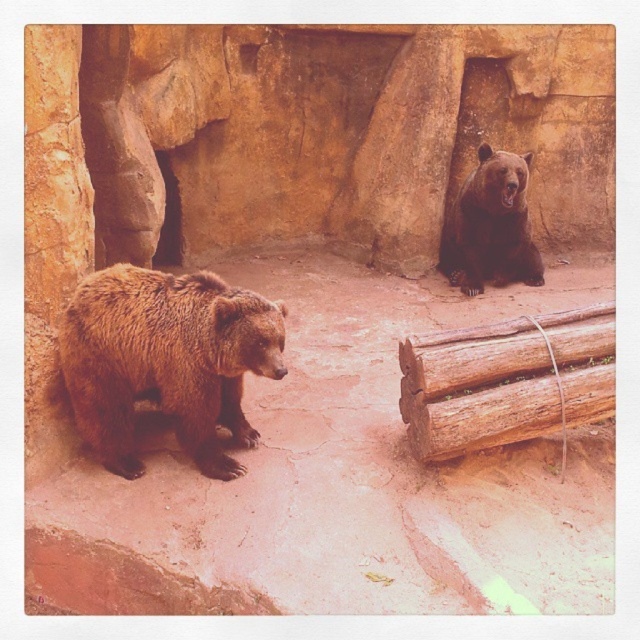
Is brown furry bear at left above brown rough wood at lower right?

Yes.

Does brown furry bear at left appear on the right side of brown rough wood at lower right?

In fact, brown furry bear at left is to the left of brown rough wood at lower right.

Locate an element on the screen. The height and width of the screenshot is (640, 640). brown furry bear at left is located at coordinates (164, 360).

Can you confirm if brown furry bear at left is wider than brown furry bear at upper right?

Yes, brown furry bear at left is wider than brown furry bear at upper right.

Is brown furry bear at left to the right of brown furry bear at upper right from the viewer's perspective?

Incorrect, brown furry bear at left is not on the right side of brown furry bear at upper right.

Find the location of a particular element. The width and height of the screenshot is (640, 640). brown furry bear at left is located at coordinates (164, 360).

Based on the photo, does brown rough wood at lower right have a greater width compared to brown furry bear at upper right?

Indeed, brown rough wood at lower right has a greater width compared to brown furry bear at upper right.

Which is behind, point (508, 416) or point (476, 182)?

The point (476, 182) is more distant.

Is point (611, 349) positioned in front of point (490, 257)?

Yes, it is in front of point (490, 257).

At what (x,y) coordinates should I click in order to perform the action: click on brown rough wood at lower right. Please return your answer as a coordinate pair (x, y). The height and width of the screenshot is (640, 640). Looking at the image, I should click on (506, 380).